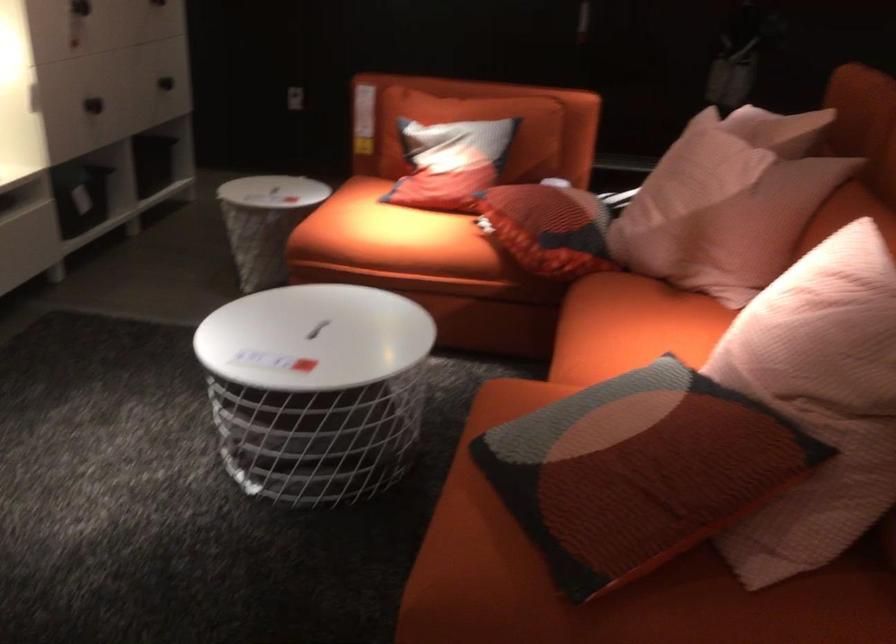
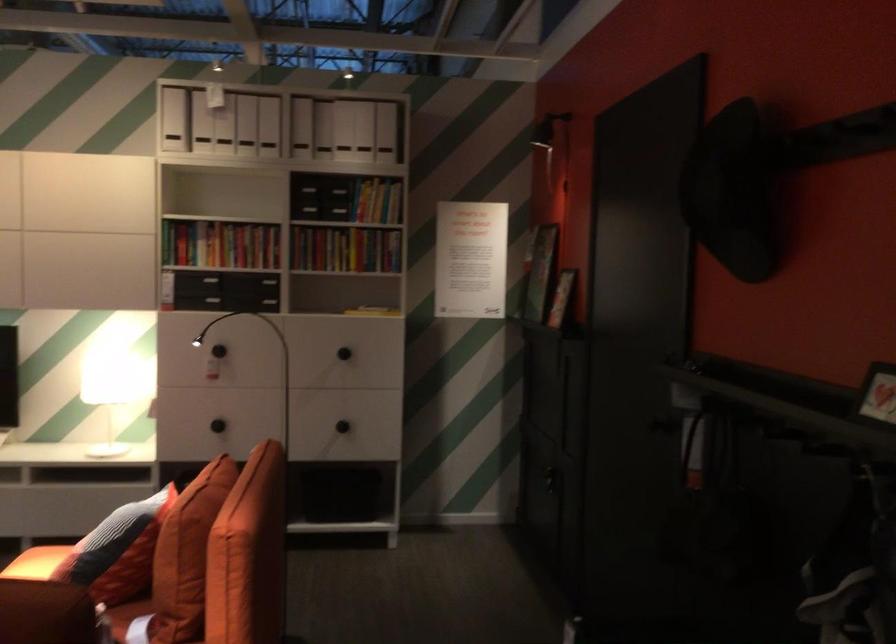
Where in the second image is the point corresponding to (x=565, y=122) from the first image?

(186, 554)